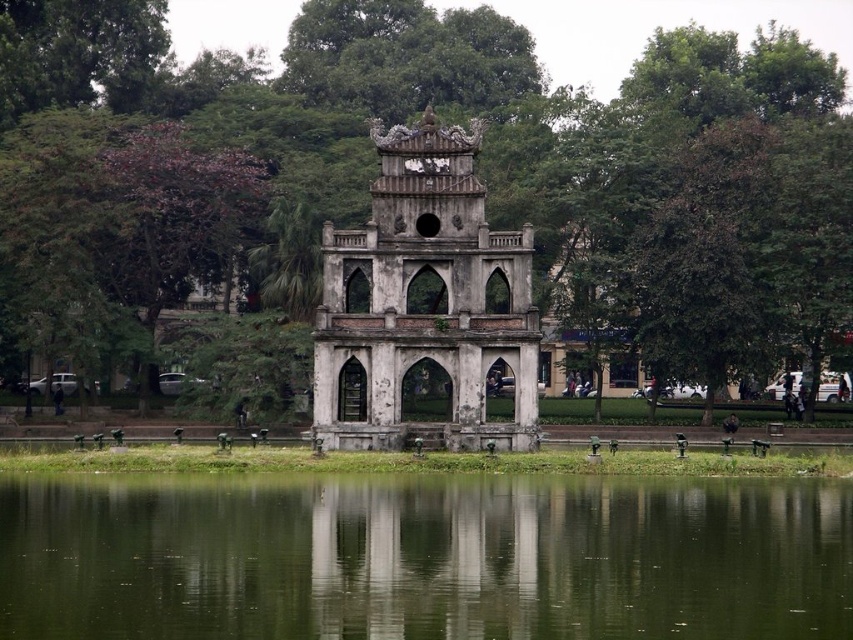
You are standing on the bank of the lake and see the green leafy tree at center and the green reflective water at center. Which object is closer to you?

The green leafy tree at center is closer to you because it is further to the viewer than the green reflective water at center.